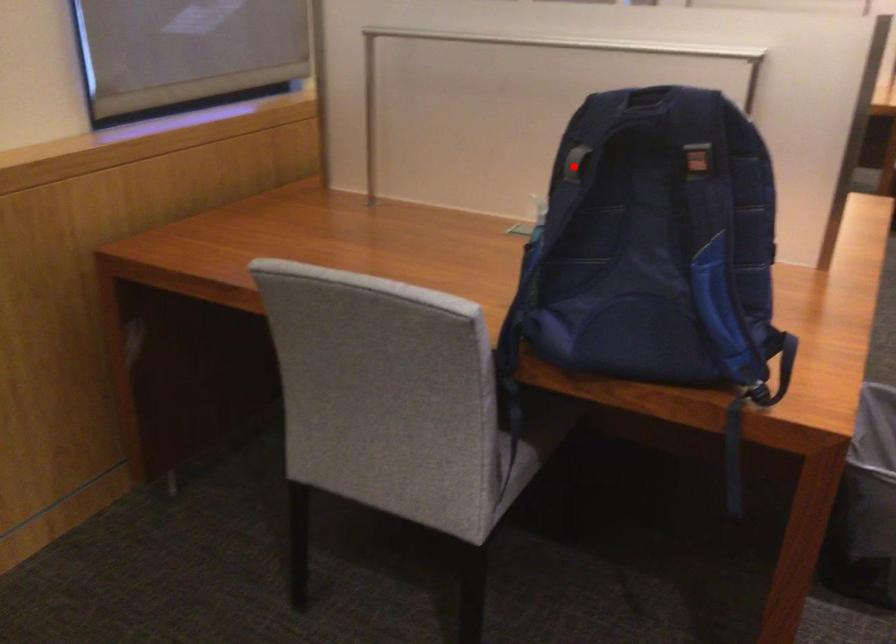
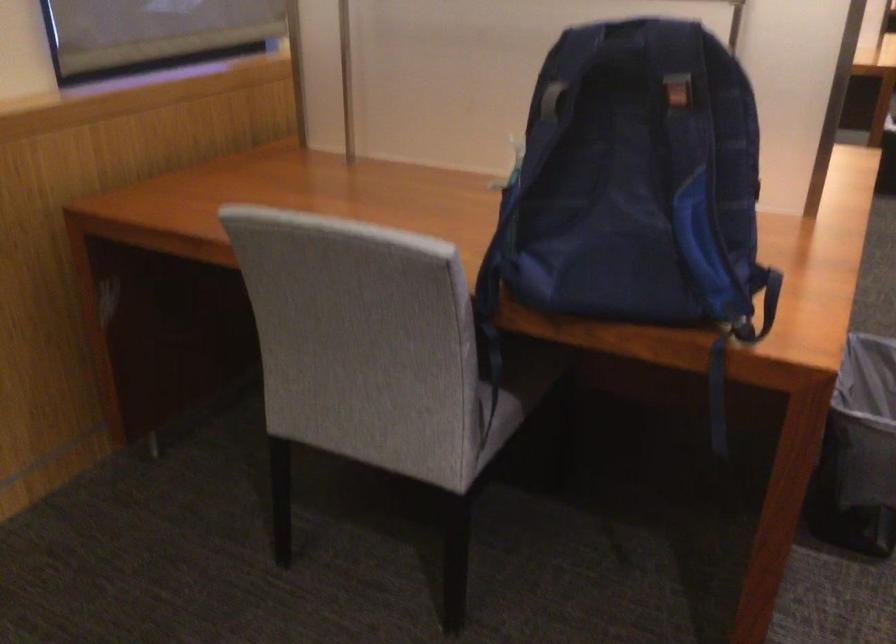
In the second image, find the point that corresponds to the highlighted location in the first image.

(552, 100)